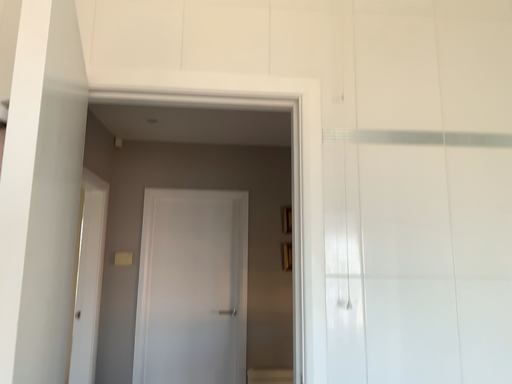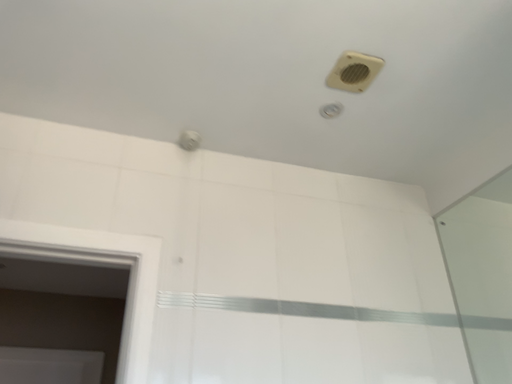
Question: How did the camera likely rotate when shooting the video?

Choices:
 (A) rotated upward
 (B) rotated downward

Answer: (A)